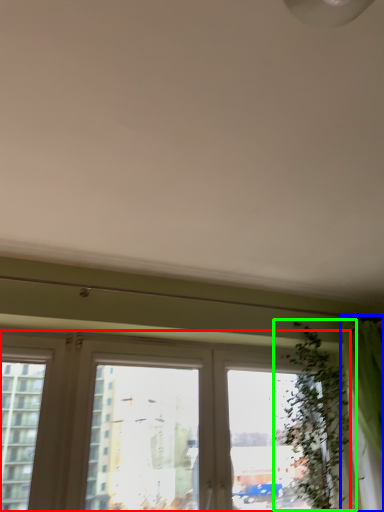
Question: Considering the real-world distances, which object is closest to window (highlighted by a red box)? curtain (highlighted by a blue box) or vegetation (highlighted by a green box).

Choices:
 (A) curtain
 (B) vegetation

Answer: (B)